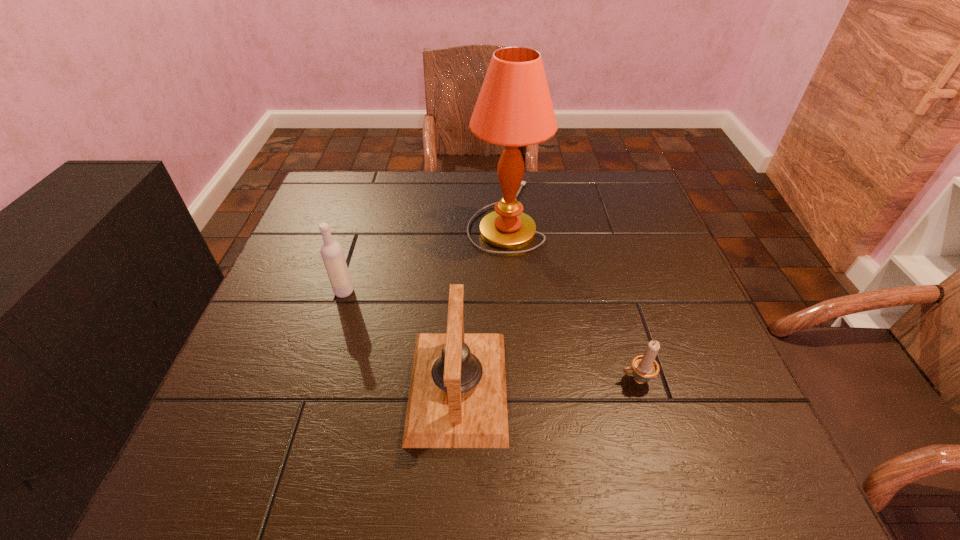
Image resolution: width=960 pixels, height=540 pixels. Find the location of `vacant space at the right edge`. vacant space at the right edge is located at coordinates (691, 404).

This screenshot has width=960, height=540. Identify the location of free region at the far left corner. (366, 178).

Locate an element on the screen. vacant region at the far right corner of the desktop is located at coordinates (609, 172).

At what (x,y) coordinates should I click in order to perform the action: click on empty space between the bell and the lamp. Please return your answer as a coordinate pair (x, y). Looking at the image, I should click on (481, 301).

Image resolution: width=960 pixels, height=540 pixels. I want to click on empty space that is in between the lamp and the candle_holder, so tap(570, 298).

I want to click on unoccupied position between the bell and the rightmost object, so click(547, 383).

Where is `free point between the bell and the farthest object`? free point between the bell and the farthest object is located at coordinates (481, 301).

In order to click on empty space between the bell and the lamp in this screenshot , I will do `click(481, 301)`.

The image size is (960, 540). I want to click on vacant area that lies between the second farthest object and the bell, so click(x=401, y=339).

Find the location of a particular element. empty space that is in between the bell and the candle_holder is located at coordinates (547, 383).